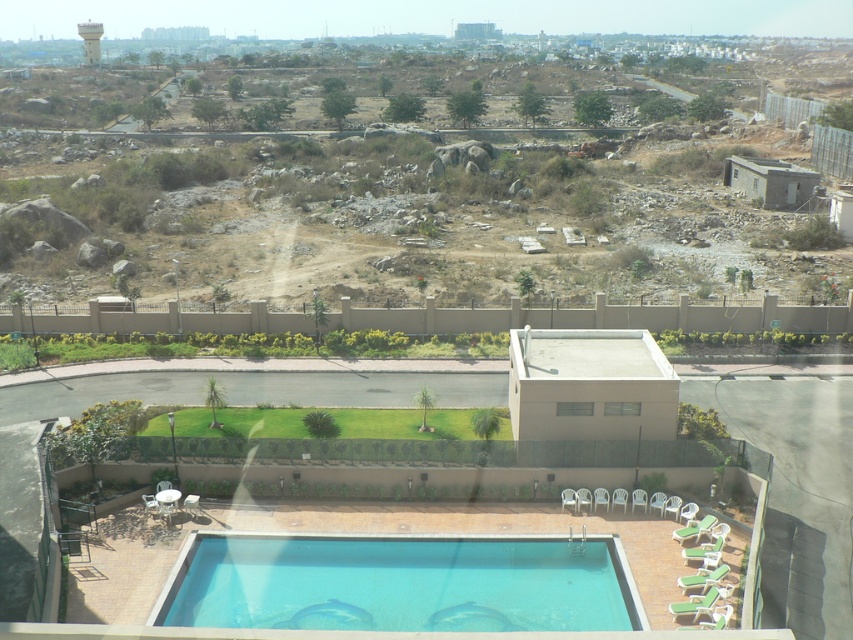
Question: Which point is farther to the camera?

Choices:
 (A) (254, 188)
 (B) (457, 554)
 (C) (86, 40)

Answer: (C)

Question: Does clear glass pool at lower center lie behind white concrete water tower at upper left?

Choices:
 (A) no
 (B) yes

Answer: (A)

Question: In this image, where is brown rocky terrain at upper center located relative to white concrete water tower at upper left?

Choices:
 (A) above
 (B) below

Answer: (B)

Question: In this image, where is clear glass pool at lower center located relative to white concrete water tower at upper left?

Choices:
 (A) below
 (B) above

Answer: (A)

Question: Which point is farther to the camera?

Choices:
 (A) clear glass pool at lower center
 (B) brown rocky terrain at upper center

Answer: (B)

Question: Considering the real-world distances, which object is closest to the brown rocky terrain at upper center?

Choices:
 (A) clear glass pool at lower center
 (B) white concrete water tower at upper left

Answer: (A)